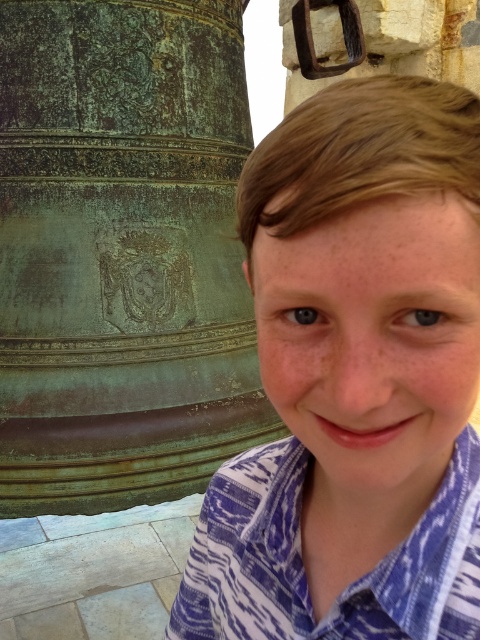
Between matte bronze bell at left and green patina bell at left, which one is positioned lower?

Positioned lower is matte bronze bell at left.

Is matte bronze bell at left below green patina bell at left?

Yes, matte bronze bell at left is below green patina bell at left.

Between point (355, 323) and point (84, 429), which one is positioned behind?

Point (84, 429)

The image size is (480, 640). Identify the location of matte bronze bell at left. (355, 378).

Is the position of green patina bell at left less distant than that of blue printed shirt at right?

No, it is not.

Does point (33, 406) come behind point (394, 550)?

Yes, it is behind point (394, 550).

Is point (181, 358) positioned after point (252, 483)?

That is True.

I want to click on green patina bell at left, so click(121, 252).

Is matte bronze bell at left bigger than blue printed shirt at right?

Yes.

The width and height of the screenshot is (480, 640). What do you see at coordinates (355, 378) in the screenshot? I see `matte bronze bell at left` at bounding box center [355, 378].

Where is `matte bronze bell at left`? Image resolution: width=480 pixels, height=640 pixels. matte bronze bell at left is located at coordinates (355, 378).